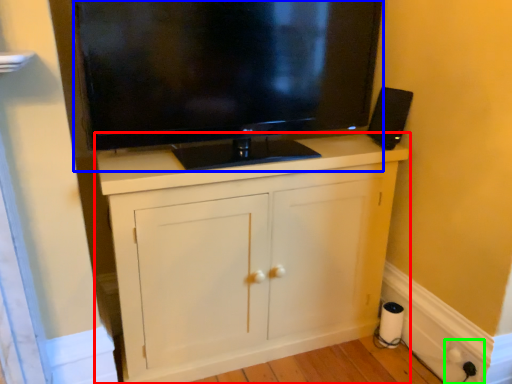
Question: Considering the real-world distances, which object is closest to cabinetry (highlighted by a red box)? television (highlighted by a blue box) or electric outlet (highlighted by a green box).

Choices:
 (A) television
 (B) electric outlet

Answer: (A)